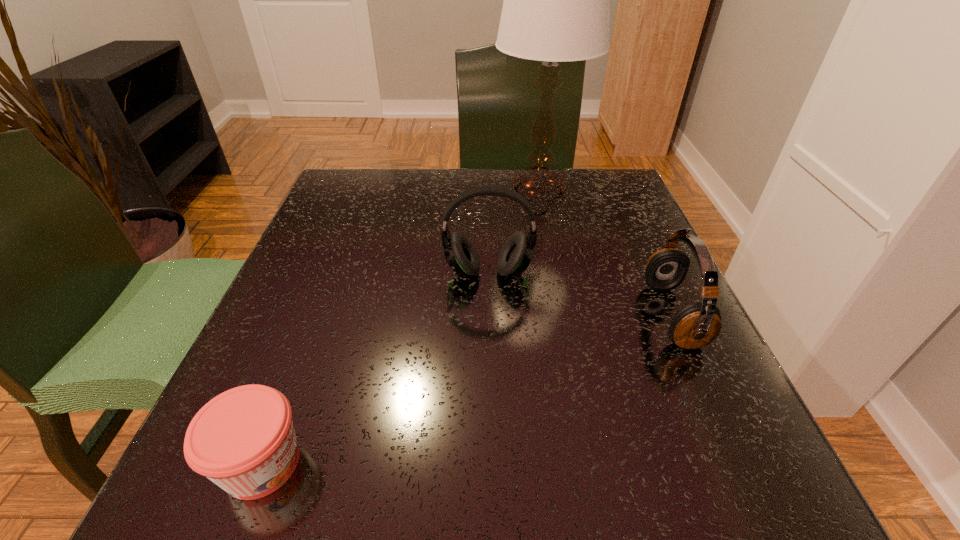
Find the location of a particular element. vacant area that lies between the left headset and the shorter headset is located at coordinates (581, 294).

Locate an element on the screen. object that is the second closest to the rightmost object is located at coordinates (556, 8).

Locate which object is the third closest to the tallest object. Please provide its 2D coordinates. Your answer should be formatted as a tuple, i.e. [(x, y)], where the tuple contains the x and y coordinates of a point satisfying the conditions above.

[(243, 440)]

Identify the location of vacant point that satisfies the following two spatial constraints: 1. on the front-facing side of the farthest object; 2. on the ear cups of the third shortest object. Image resolution: width=960 pixels, height=540 pixels. (554, 273).

Where is `free space that satisfies the following two spatial constraints: 1. on the front-facing side of the table lamp; 2. on the ear cups of the taller headset`? This screenshot has height=540, width=960. free space that satisfies the following two spatial constraints: 1. on the front-facing side of the table lamp; 2. on the ear cups of the taller headset is located at coordinates (554, 273).

Identify the location of free spot that satisfies the following two spatial constraints: 1. on the front-facing side of the tallest object; 2. on the ear cups of the left headset. (554, 273).